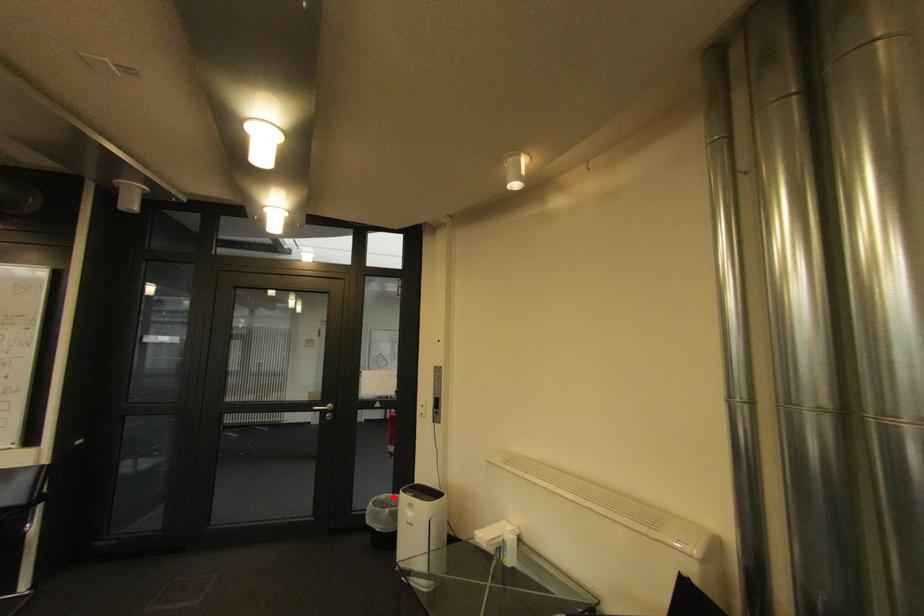
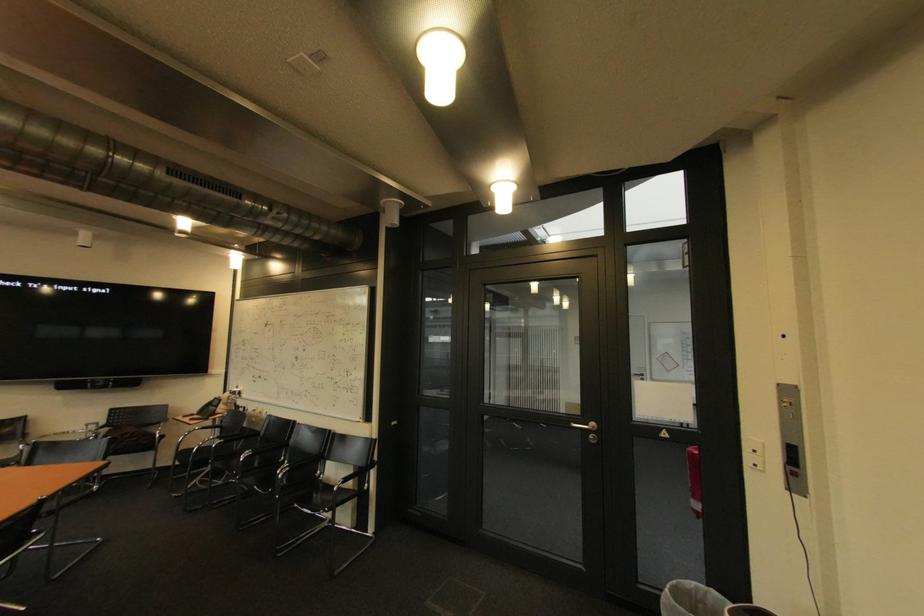
The point at the highlighted location is marked in the first image. Where is the corresponding point in the second image?

(701, 585)